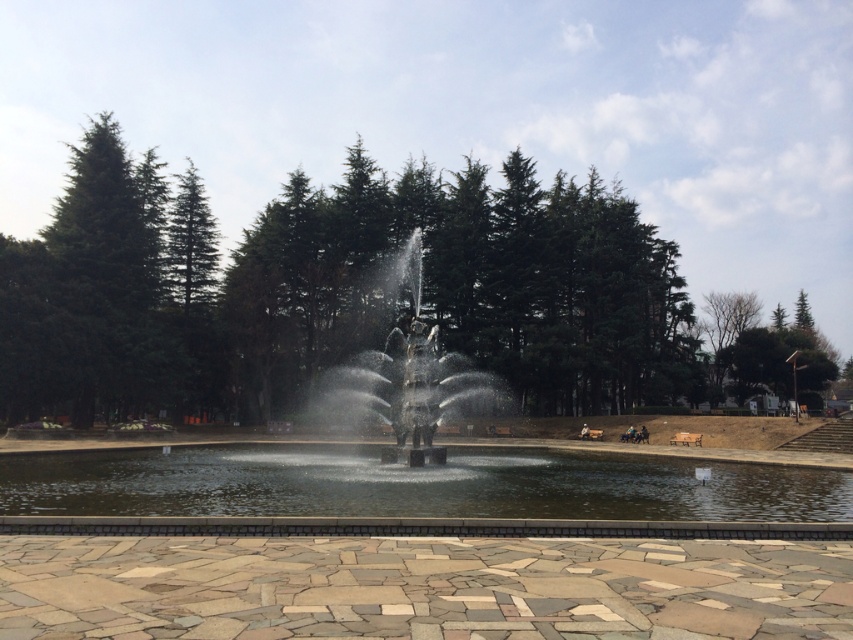
From the picture: You are standing at the fountain in the park and want to walk to the point marked by point (263, 380) and point (660, 468). Which point is closer to you?

Point (660, 468) is closer to you because it is in front of point (263, 380).